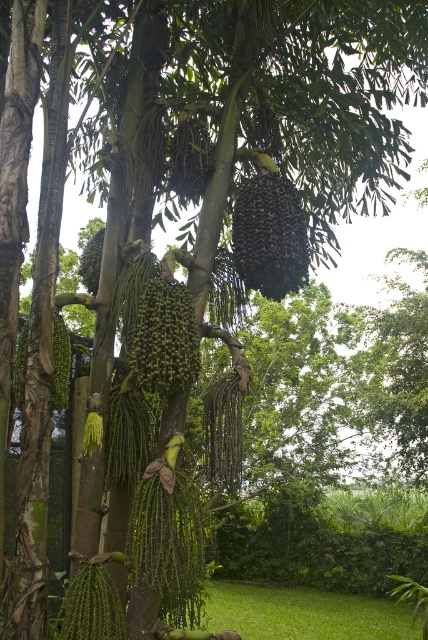
Consider the image. You are an explorer in the jungle and see the dark green glossy palm fruit at center and the green matte palm fruit at left. Which one is positioned to the right of the other?

The dark green glossy palm fruit at center is positioned to the right of the green matte palm fruit at left.

You are a gardener trying to determine which object in the scene is taller. You see the green grass at lower center and the green matte palm fruit at upper center. Which one is taller?

The green grass at lower center is taller than the green matte palm fruit at upper center according to the description.

Based on the photo, you are a gardener who wants to water the green grass at lower center without getting the dark green glossy palm fruit at center wet. Which direction should you aim the water?

You should aim the water towards the green grass at lower center since it is positioned under the dark green glossy palm fruit at center, so watering from below will keep the fruit dry.